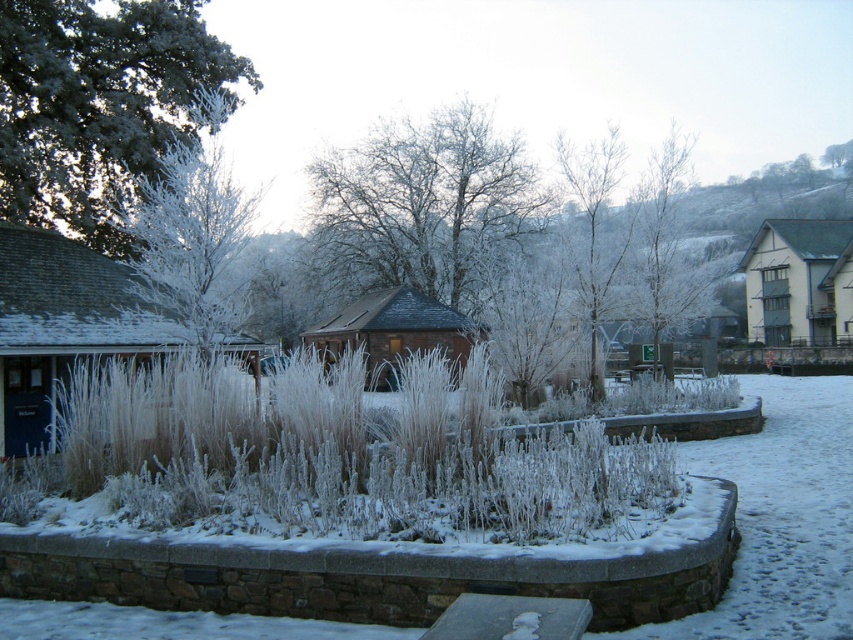
You are a gardener planning to clear the snow from the frosted grass at center and the frosted wood tree at center. Based on their positions, which object should you start with first to avoid stepping on the other?

The frosted grass at center is positioned under the frosted wood tree at center, so you should start clearing the snow from the frosted wood tree at center first to avoid stepping on the frosted grass at center below it.